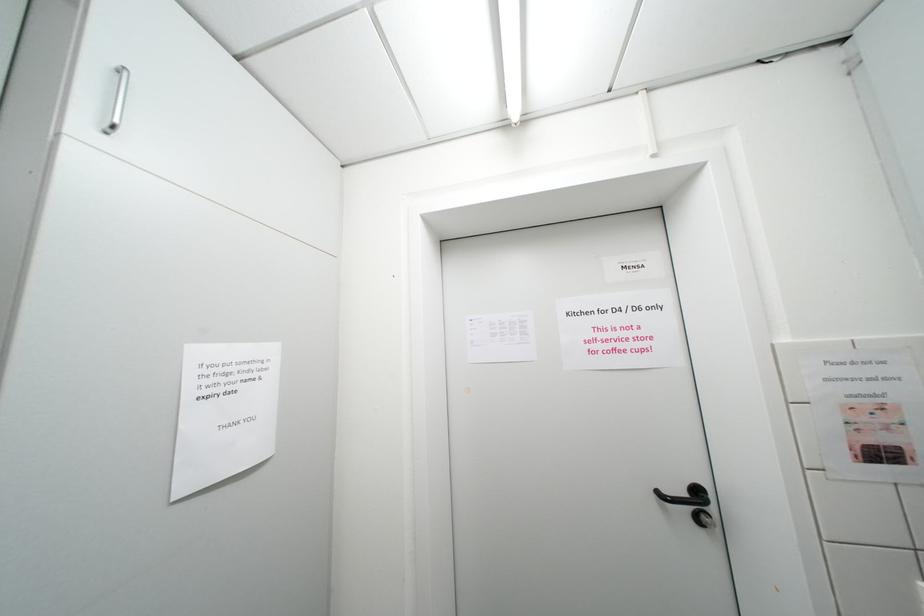
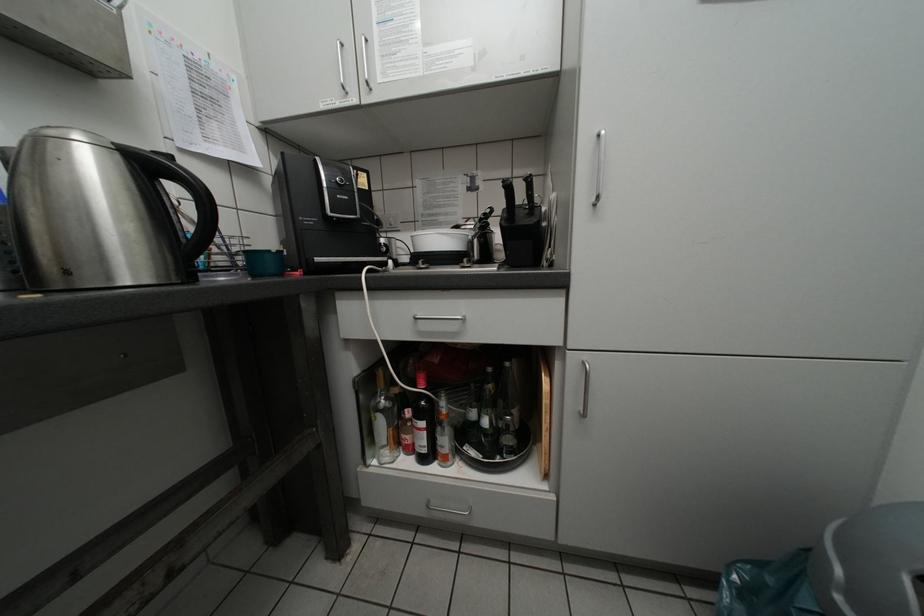
Question: The first image is from the beginning of the video and the second image is from the end. How did the camera likely rotate when shooting the video?

Choices:
 (A) Left
 (B) Right
 (C) Up
 (D) Down

Answer: (A)